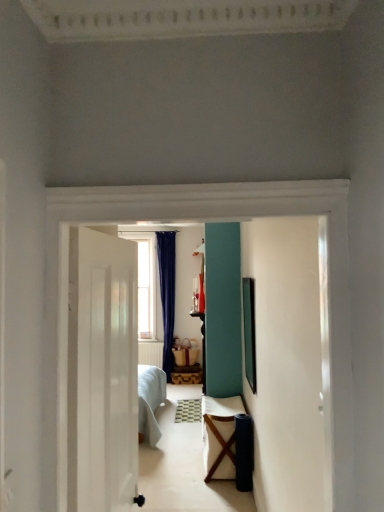
At what (x,y) coordinates should I click in order to perform the action: click on wooden chair at center. Please return your answer as a coordinate pair (x, y). Looking at the image, I should click on (220, 436).

The image size is (384, 512). What do you see at coordinates (220, 436) in the screenshot? I see `wooden chair at center` at bounding box center [220, 436].

Where is `wooden chair at center`? Image resolution: width=384 pixels, height=512 pixels. wooden chair at center is located at coordinates (x=220, y=436).